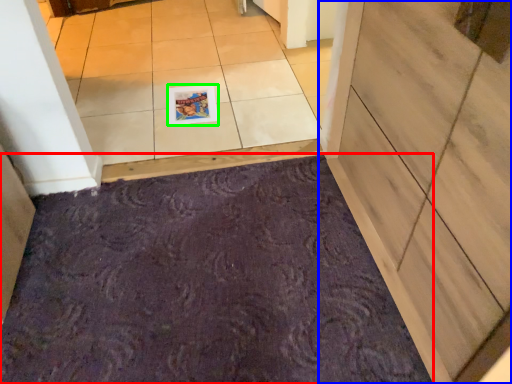
Question: Considering the real-world distances, which object is closest to bath mat (highlighted by a red box)? door (highlighted by a blue box) or postcard (highlighted by a green box).

Choices:
 (A) door
 (B) postcard

Answer: (A)